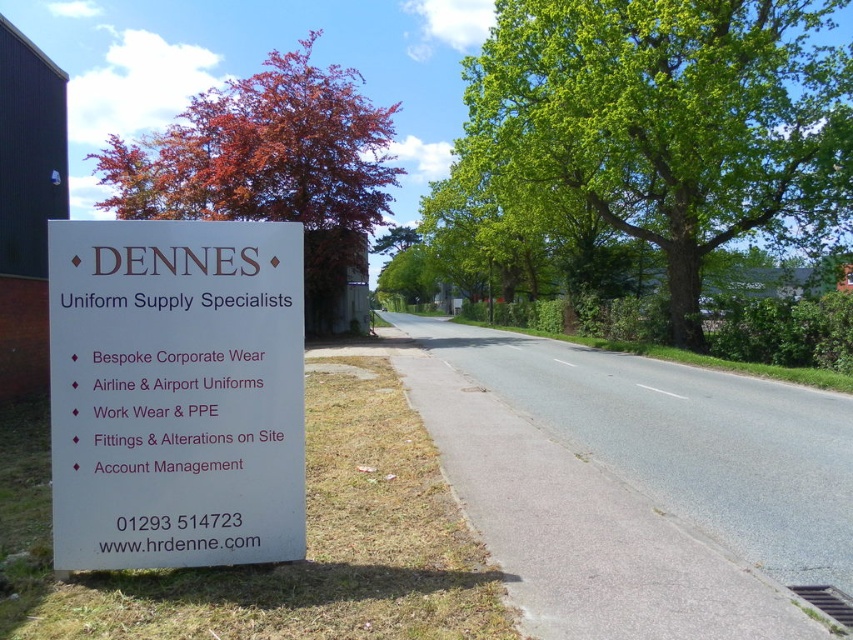
Question: Can you confirm if green leafy tree at upper right is thinner than white plastic sign at left?

Choices:
 (A) no
 (B) yes

Answer: (A)

Question: Which object appears closest to the camera in this image?

Choices:
 (A) reddish-brown bark tree at upper left
 (B) white plastic sign at left
 (C) green leafy tree at upper right

Answer: (B)

Question: Can you confirm if green leafy tree at upper right is smaller than reddish-brown bark tree at upper left?

Choices:
 (A) yes
 (B) no

Answer: (A)

Question: Estimate the real-world distances between objects in this image. Which object is farther from the green leafy tree at upper right?

Choices:
 (A) reddish-brown bark tree at upper left
 (B) white plastic sign at left

Answer: (B)

Question: Which object is closer to the camera taking this photo?

Choices:
 (A) reddish-brown bark tree at upper left
 (B) green leafy tree at upper right
 (C) white plastic sign at left

Answer: (C)

Question: Does white plastic sign at left appear over reddish-brown bark tree at upper left?

Choices:
 (A) yes
 (B) no

Answer: (B)